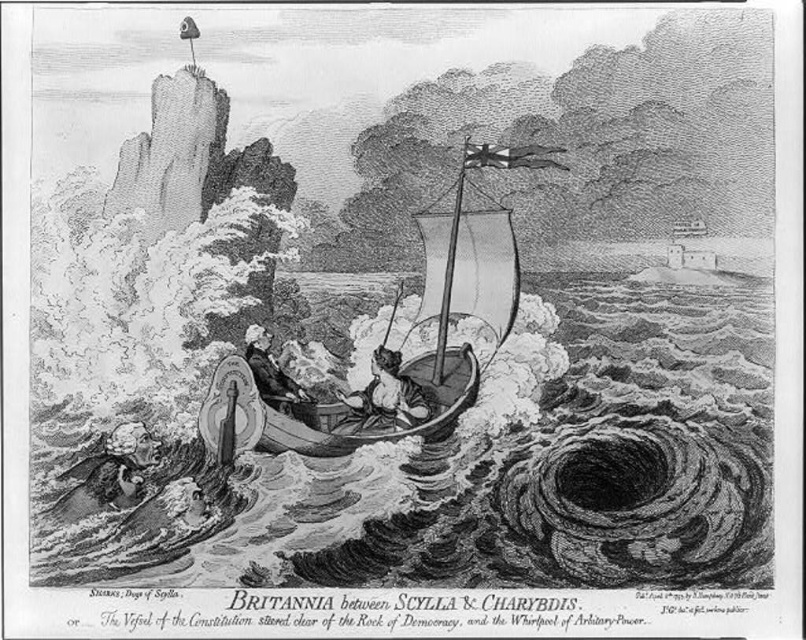
Can you confirm if wooden sailboat at center is shorter than smooth skin woman at center?

Incorrect, wooden sailboat at center's height does not fall short of smooth skin woman at center's.

Is wooden sailboat at center positioned in front of smooth skin woman at center?

Yes, it is.

Identify the location of wooden sailboat at center. (405, 333).

Is point (356, 426) positioned before point (254, 374)?

No, (356, 426) is further to viewer.

Between point (424, 408) and point (260, 369), which one is positioned in front?

Positioned in front is point (424, 408).

The image size is (806, 640). What are the coordinates of `smooth skin woman at center` in the screenshot? It's located at (384, 397).

Who is lower down, wooden sailboat at center or smooth leather jacket at center?

smooth leather jacket at center is lower down.

I want to click on wooden sailboat at center, so click(405, 333).